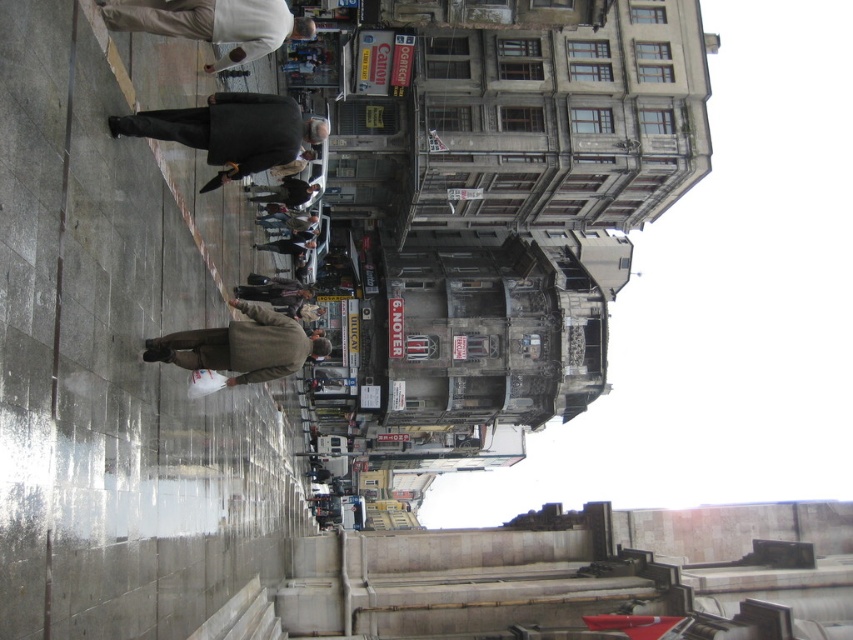
Question: Which point is closer to the camera?

Choices:
 (A) (219, 8)
 (B) (283, 125)

Answer: (B)

Question: Can you confirm if dark wool coat at center is positioned above brown woolen coat at lower center?

Choices:
 (A) yes
 (B) no

Answer: (A)

Question: Among these objects, which one is farthest from the camera?

Choices:
 (A) dark wool coat at center
 (B) white matte jacket at upper center

Answer: (A)

Question: Which point is closer to the camera taking this photo?

Choices:
 (A) (248, 22)
 (B) (288, 116)
 (C) (305, 340)

Answer: (B)

Question: Does white matte jacket at upper center have a greater width compared to brown woolen coat at lower center?

Choices:
 (A) no
 (B) yes

Answer: (A)

Question: Is dark wool coat at center thinner than brown woolen coat at lower center?

Choices:
 (A) yes
 (B) no

Answer: (A)